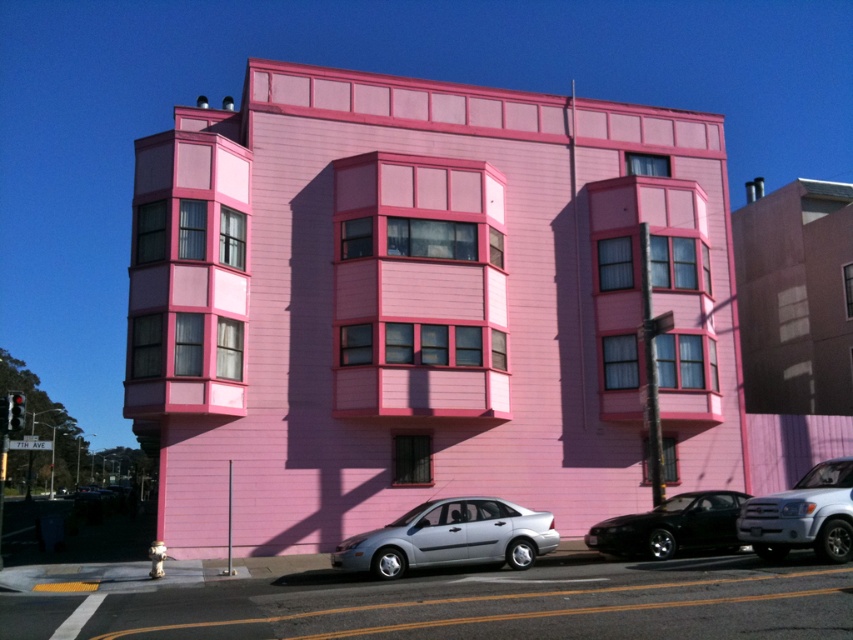
Between satin silver sedan at center and satin white suv at lower right, which one is positioned higher?

satin white suv at lower right is higher up.

Is point (505, 547) positioned before point (848, 481)?

That is False.

Who is more distant from viewer, (x=471, y=541) or (x=805, y=524)?

Positioned behind is point (x=471, y=541).

What are the coordinates of `satin silver sedan at center` in the screenshot? It's located at (450, 538).

Is point (821, 552) closer to camera compared to point (599, 541)?

Yes.

Which of these two, satin white suv at lower right or shiny black car at lower right, stands shorter?

With less height is shiny black car at lower right.

Where is `satin white suv at lower right`? The width and height of the screenshot is (853, 640). satin white suv at lower right is located at coordinates pos(804,515).

Is satin silver sedan at center taller than shiny black car at lower right?

Incorrect, satin silver sedan at center's height is not larger of shiny black car at lower right's.

Is satin silver sedan at center to the left of shiny black car at lower right from the viewer's perspective?

Yes, satin silver sedan at center is to the left of shiny black car at lower right.

Between point (415, 532) and point (686, 493), which one is positioned in front?

Point (415, 532)

At what (x,y) coordinates should I click in order to perform the action: click on satin silver sedan at center. Please return your answer as a coordinate pair (x, y). Image resolution: width=853 pixels, height=640 pixels. Looking at the image, I should click on (450, 538).